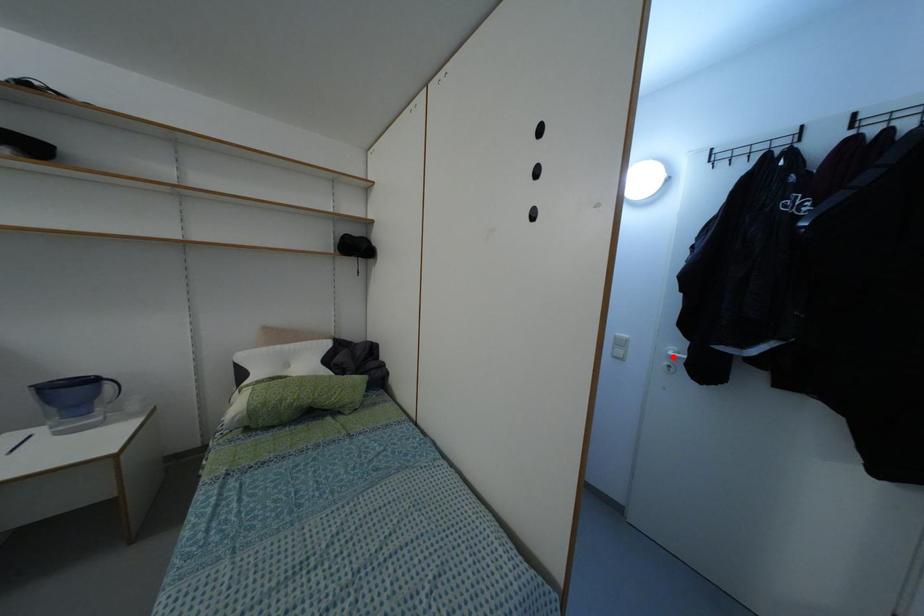
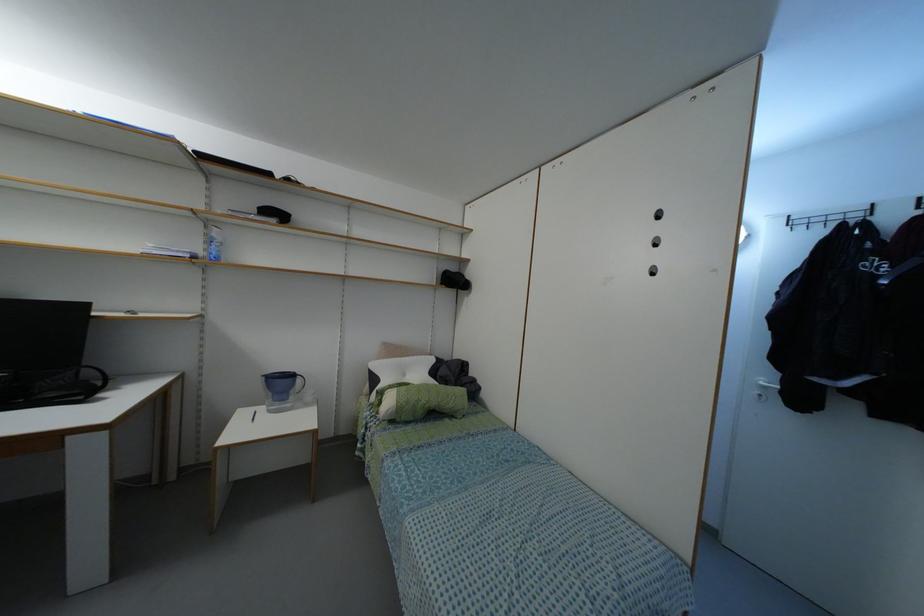
Find the pixel in the second image that matches the highlighted location in the first image.

(763, 387)